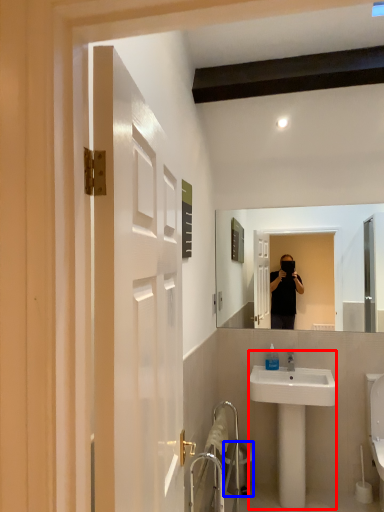
Question: Among these objects, which one is farthest to the camera, sink (highlighted by a red box) or trash bin/can (highlighted by a blue box)?

Choices:
 (A) sink
 (B) trash bin/can

Answer: (B)